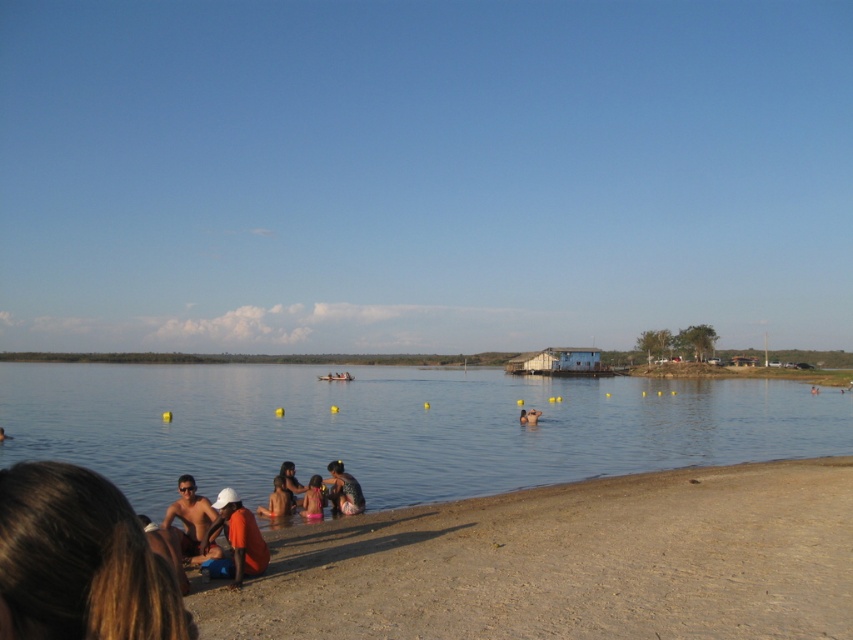
You are a photographer trying to capture a shot of the light brown sandy beach at lower left and the dark brown leather jacket at lower center. Based on their heights, which object will appear closer to the waterline in your photo?

The light brown sandy beach at lower left has a lesser height compared to the dark brown leather jacket at lower center, so it will appear closer to the waterline in the photo.

You are standing on the orange fabric at lower left and want to walk to the light brown sandy beach at lower left. Which direction should you move in?

You should move to the right to reach the light brown sandy beach at lower left because it is located to the right of the orange fabric at lower left.